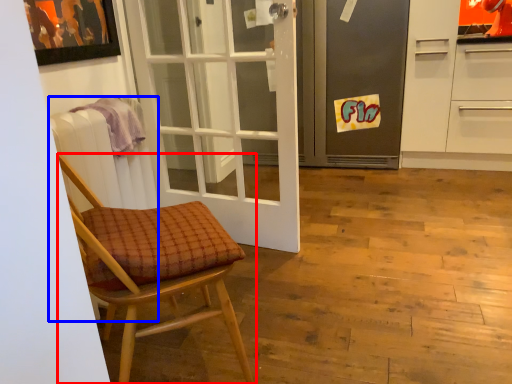
Question: Which of the following is the closest to the observer, chair (highlighted by a red box) or radiator (highlighted by a blue box)?

Choices:
 (A) chair
 (B) radiator

Answer: (A)